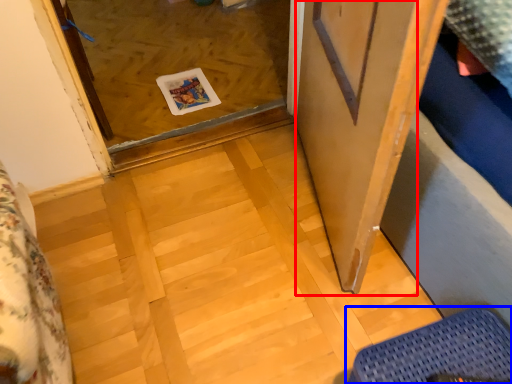
Question: Which point is closer to the camera, screen door (highlighted by a red box) or furniture (highlighted by a blue box)?

Choices:
 (A) screen door
 (B) furniture

Answer: (A)